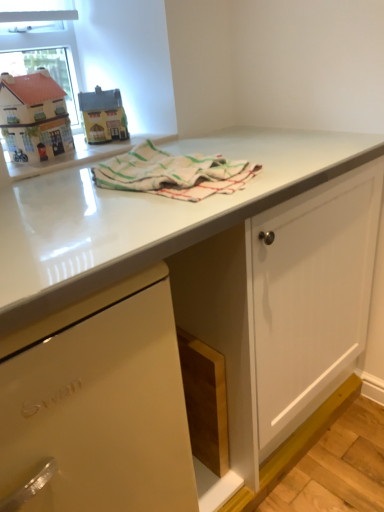
Question: In terms of size, does white striped cloth at center appear bigger or smaller than matte white dishwasher at lower left?

Choices:
 (A) big
 (B) small

Answer: (B)

Question: Considering their positions, is white striped cloth at center located in front of or behind matte white dishwasher at lower left?

Choices:
 (A) front
 (B) behind

Answer: (B)

Question: Estimate the real-world distances between objects in this image. Which object is closer to the white striped cloth at center?

Choices:
 (A) clear glass window screen at upper left
 (B) matte plastic toy house at upper left
 (C) matte white dishwasher at lower left

Answer: (C)

Question: Which of these objects is positioned closest to the matte white dishwasher at lower left?

Choices:
 (A) clear glass window screen at upper left
 (B) matte plastic toy house at upper left
 (C) white striped cloth at center

Answer: (C)